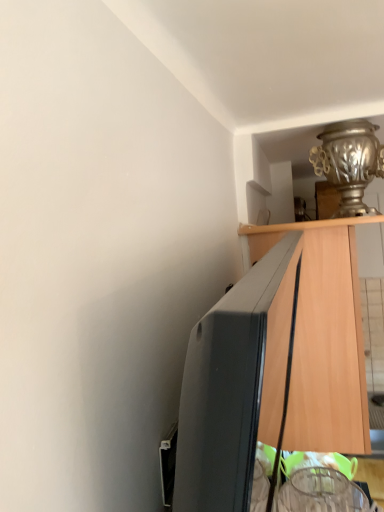
Question: Is wooden cabinet at right wider or thinner than silver metallic vase at upper right?

Choices:
 (A) thin
 (B) wide

Answer: (B)

Question: From their relative heights in the image, would you say wooden cabinet at right is taller or shorter than silver metallic vase at upper right?

Choices:
 (A) short
 (B) tall

Answer: (B)

Question: Considering the positions of point (276, 414) and point (332, 182), is point (276, 414) closer or farther from the camera than point (332, 182)?

Choices:
 (A) closer
 (B) farther

Answer: (A)

Question: From a real-world perspective, is silver metallic vase at upper right above or below wooden cabinet at right?

Choices:
 (A) above
 (B) below

Answer: (A)

Question: Is silver metallic vase at upper right to the left or to the right of wooden cabinet at right in the image?

Choices:
 (A) right
 (B) left

Answer: (B)

Question: Would you say silver metallic vase at upper right is inside or outside wooden cabinet at right?

Choices:
 (A) outside
 (B) inside

Answer: (A)

Question: From their relative heights in the image, would you say silver metallic vase at upper right is taller or shorter than wooden cabinet at right?

Choices:
 (A) tall
 (B) short

Answer: (B)